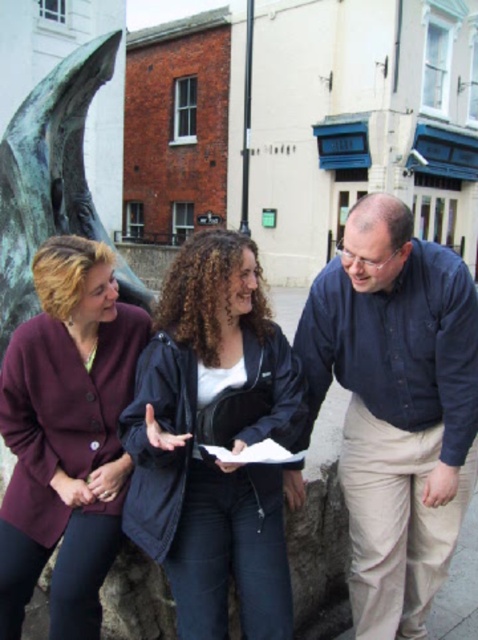
Based on the photo, you are a photographer trying to capture a group photo of the matte purple cardigan at center left and the dark blue jacket at center. Since you want to ensure both are fully visible, which one should you position closer to the front?

The matte purple cardigan at center left is positioned under the dark blue jacket at center, so to ensure both are fully visible, the dark blue jacket at center should be moved slightly forward so that the matte purple cardigan at center left isn not blocked.